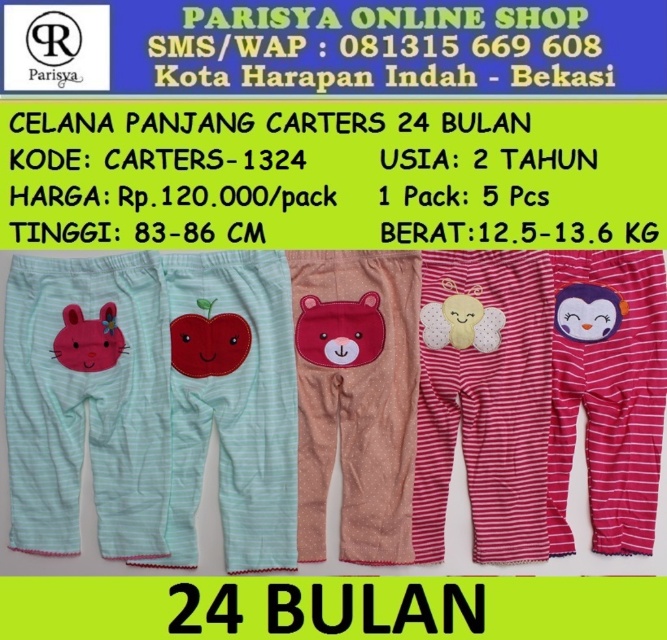
Is light blue striped pants with apple applique at center to the right of fluffy white bear at center from the viewer's perspective?

In fact, light blue striped pants with apple applique at center is to the left of fluffy white bear at center.

Who is positioned more to the left, light blue striped pants with apple applique at center or fluffy white bear at center?

Positioned to the left is light blue striped pants with apple applique at center.

Which is in front, point (285, 492) or point (454, 340)?

Point (285, 492) is in front.

This screenshot has height=640, width=667. I want to click on light blue striped pants with apple applique at center, so click(231, 404).

Between striped cotton pants with bee applique at center and purple plush penguin at center, which one is positioned higher?

purple plush penguin at center is above.

Between point (426, 525) and point (590, 332), which one is positioned behind?

Positioned behind is point (590, 332).

Where is `striped cotton pants with bee applique at center`? striped cotton pants with bee applique at center is located at coordinates (484, 400).

Which is more to the left, brown plush bear at center or matte red apple at center?

From the viewer's perspective, matte red apple at center appears more on the left side.

Between brown plush bear at center and matte red apple at center, which one appears on the right side from the viewer's perspective?

brown plush bear at center is more to the right.

Image resolution: width=667 pixels, height=640 pixels. What are the coordinates of `brown plush bear at center` in the screenshot? It's located at (340, 330).

Find the location of a particular element. brown plush bear at center is located at coordinates (340, 330).